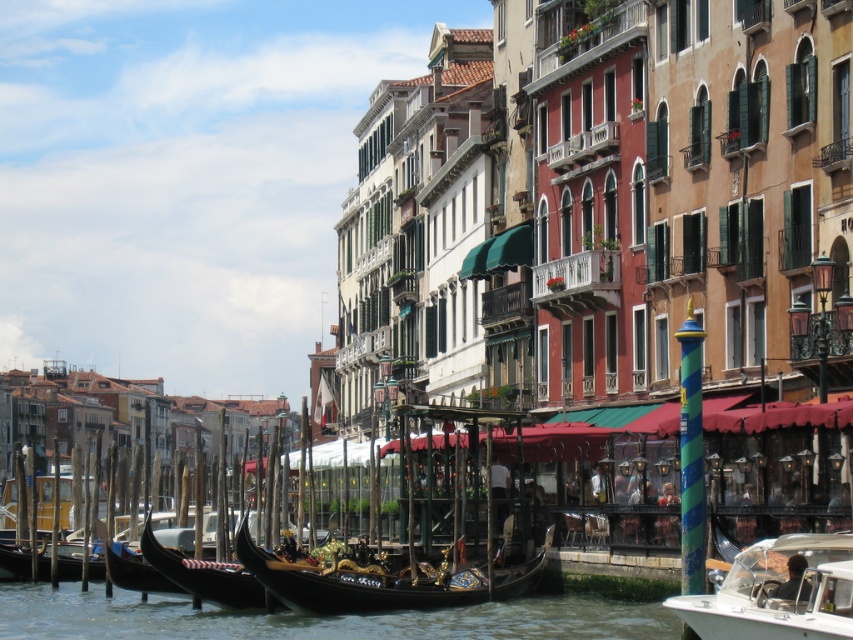
Which is more to the right, black polished gondola at center or polished wood gondola at center?

From the viewer's perspective, black polished gondola at center appears more on the right side.

Is point (294, 604) more distant than point (218, 563)?

No.

Which is in front, point (515, 570) or point (256, 582)?

Point (515, 570)

You are a GUI agent. You are given a task and a screenshot of the screen. Output one action in this format:
    pyautogui.click(x=<x>, y=<y>)
    Task: Click on the black polished gondola at center
    Image resolution: width=853 pixels, height=640 pixels.
    Given the screenshot: What is the action you would take?
    pyautogui.click(x=381, y=580)

Is white glossy motorboat at lower right taller than polished wood gondola at center?

Yes, white glossy motorboat at lower right is taller than polished wood gondola at center.

Who is higher up, white glossy motorboat at lower right or polished wood gondola at center?

white glossy motorboat at lower right

Is point (807, 557) positioned behind point (201, 570)?

That is False.

You are a GUI agent. You are given a task and a screenshot of the screen. Output one action in this format:
    pyautogui.click(x=<x>, y=<y>)
    Task: Click on the white glossy motorboat at lower right
    The width and height of the screenshot is (853, 640).
    Given the screenshot: What is the action you would take?
    pyautogui.click(x=778, y=592)

Between white glossy motorboat at lower right and black polished gondola at center, which one is positioned higher?

black polished gondola at center is above.

Is white glossy motorboat at lower right wider than black polished gondola at center?

In fact, white glossy motorboat at lower right might be narrower than black polished gondola at center.

Which is in front, point (686, 620) or point (456, 586)?

Point (686, 620)

The image size is (853, 640). Find the location of `white glossy motorboat at lower right`. white glossy motorboat at lower right is located at coordinates (778, 592).